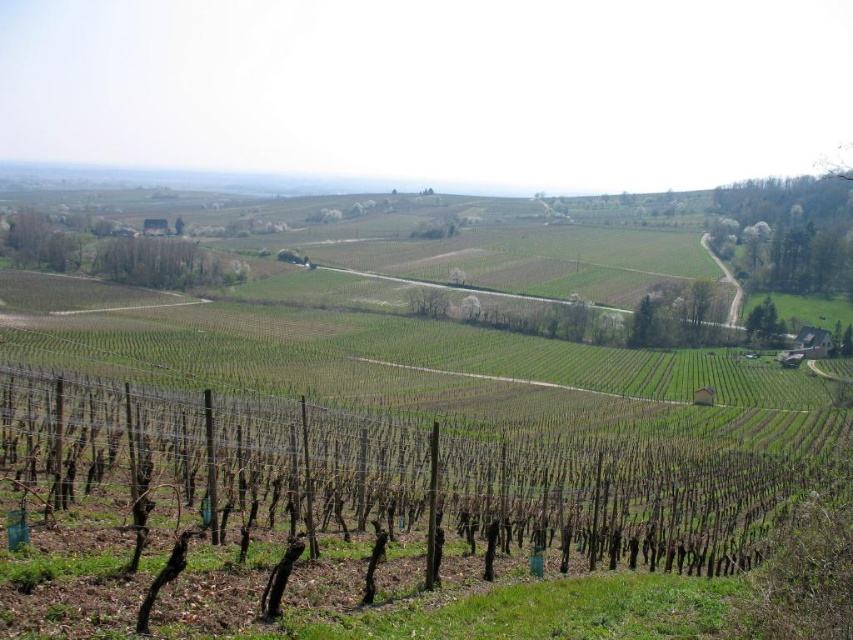
You are a landscape architect planning to add more trees to the vineyard. Given the existing green leafy tree at upper right and green leafy trees at upper left, which location would you choose to plant a new tree if you want it to be the largest in the area?

You should plant the new tree at the location of the green leafy tree at upper right because it is already bigger than the green leafy trees at upper left, so continuing there could maintain or enhance its dominance as the largest tree in the area.

Based on the photo, you are a landscape architect designing a new vineyard and want to incorporate the green leafy trees at upper left and green leafy tree at lower right. Which tree should you choose if you want a larger tree for shade?

The green leafy trees at upper left is larger in size compared to the green leafy tree at lower right, so you should choose the green leafy trees at upper left for shade.

You are standing at the center of the vineyard looking towards the distant hills. Where is the green leafy tree at upper right located in relation to your viewpoint?

The green leafy tree at upper right is located at point (788, 232) in the image, which is to the upper right direction from your viewpoint.